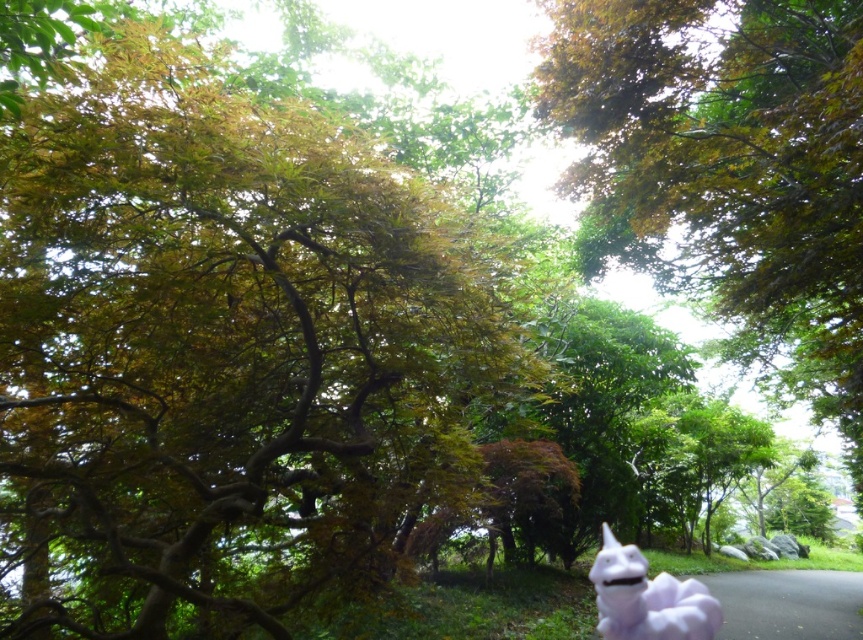
Question: Among these points, which one is nearest to the camera?

Choices:
 (A) (836, 573)
 (B) (602, 598)
 (C) (817, 388)
 (D) (256, 260)

Answer: (B)

Question: Is green leafy tree at upper left above purple fabric at lower right?

Choices:
 (A) no
 (B) yes

Answer: (B)

Question: Which object is closer to the camera taking this photo?

Choices:
 (A) purple fabric at lower right
 (B) white plush toy at lower right
 (C) green leafy tree at upper left
 (D) green leafy tree at upper center

Answer: (C)

Question: Among these objects, which one is nearest to the camera?

Choices:
 (A) green leafy tree at upper center
 (B) purple fabric at lower right
 (C) white plush toy at lower right
 (D) green leafy tree at upper left

Answer: (D)

Question: Is green leafy tree at upper center bigger than white plush toy at lower right?

Choices:
 (A) yes
 (B) no

Answer: (A)

Question: Does green leafy tree at upper left appear on the right side of purple fabric at lower right?

Choices:
 (A) no
 (B) yes

Answer: (A)